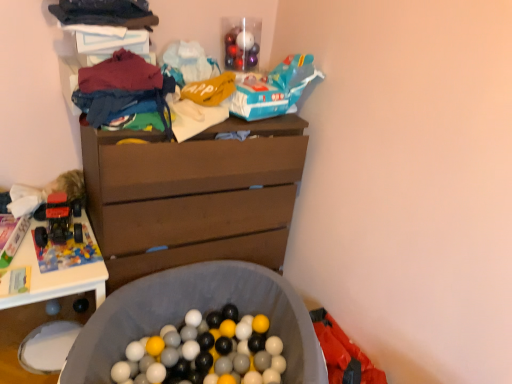
Question: Is matte blue jeans at upper left, which is the 2th clothing from top to bottom, in contact with gray fabric laundry basket at lower center?

Choices:
 (A) no
 (B) yes

Answer: (A)

Question: Is matte blue jeans at upper left, positioned as the 1th clothing in bottom-to-top order, far away from gray fabric laundry basket at lower center?

Choices:
 (A) no
 (B) yes

Answer: (A)

Question: Considering the relative sizes of matte blue jeans at upper left, positioned as the 1th clothing in bottom-to-top order, and gray fabric laundry basket at lower center in the image provided, is matte blue jeans at upper left, positioned as the 1th clothing in bottom-to-top order, bigger than gray fabric laundry basket at lower center?

Choices:
 (A) no
 (B) yes

Answer: (A)

Question: Is matte blue jeans at upper left, positioned as the 1th clothing in bottom-to-top order, outside gray fabric laundry basket at lower center?

Choices:
 (A) yes
 (B) no

Answer: (A)

Question: Does matte blue jeans at upper left, positioned as the 1th clothing in bottom-to-top order, have a greater height compared to gray fabric laundry basket at lower center?

Choices:
 (A) no
 (B) yes

Answer: (A)

Question: Would you say gray fabric laundry basket at lower center is part of matte blue jeans at upper left, which is the 2th clothing from top to bottom,'s contents?

Choices:
 (A) no
 (B) yes

Answer: (A)

Question: Is matte blue jeans at upper left, which is the 2th clothing from top to bottom, at the back of dark blue fabric at upper left, acting as the 1th clothing starting from the top?

Choices:
 (A) yes
 (B) no

Answer: (B)

Question: Is dark blue fabric at upper left, positioned as the 2th clothing in bottom-to-top order, in front of matte blue jeans at upper left, positioned as the 1th clothing in bottom-to-top order?

Choices:
 (A) no
 (B) yes

Answer: (A)

Question: Does dark blue fabric at upper left, acting as the 1th clothing starting from the top, have a lesser width compared to matte blue jeans at upper left, positioned as the 1th clothing in bottom-to-top order?

Choices:
 (A) yes
 (B) no

Answer: (A)

Question: Is dark blue fabric at upper left, positioned as the 2th clothing in bottom-to-top order, outside of matte blue jeans at upper left, which is the 2th clothing from top to bottom?

Choices:
 (A) yes
 (B) no

Answer: (A)

Question: From the image's perspective, does dark blue fabric at upper left, positioned as the 2th clothing in bottom-to-top order, appear lower than matte blue jeans at upper left, which is the 2th clothing from top to bottom?

Choices:
 (A) yes
 (B) no

Answer: (B)

Question: From a real-world perspective, is dark blue fabric at upper left, positioned as the 2th clothing in bottom-to-top order, under matte blue jeans at upper left, positioned as the 1th clothing in bottom-to-top order?

Choices:
 (A) no
 (B) yes

Answer: (A)

Question: From the image's perspective, does brown wood chest of drawers at center appear lower than white plastic table at left?

Choices:
 (A) no
 (B) yes

Answer: (A)